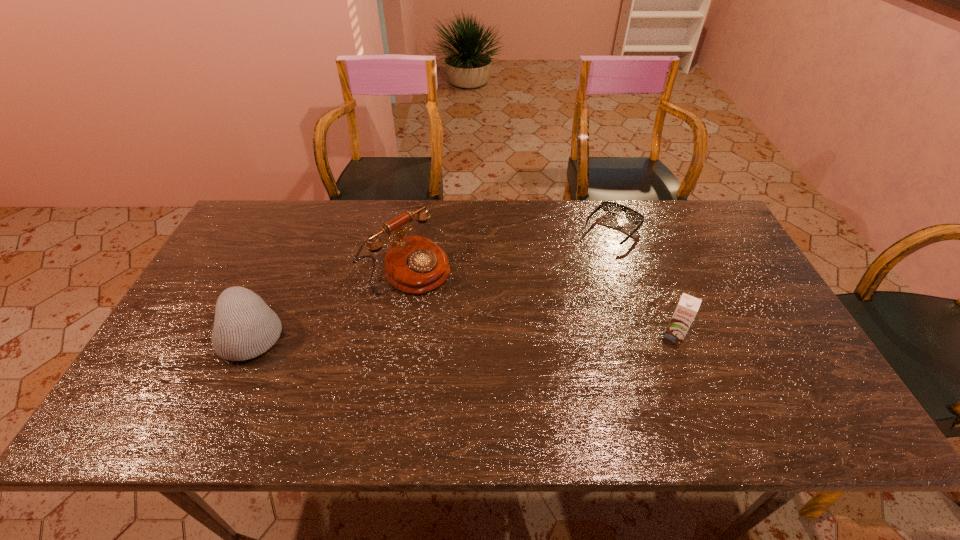
This screenshot has height=540, width=960. Identify the location of free space on the desktop that is between the leftmost object and the chocolate milk and is positioned on the dial of the telephone. (498, 335).

Where is `free spot on the desktop that is between the beanie and the chocolate milk and is positioned on the front-facing side of the sunglasses`? Image resolution: width=960 pixels, height=540 pixels. free spot on the desktop that is between the beanie and the chocolate milk and is positioned on the front-facing side of the sunglasses is located at coordinates (518, 335).